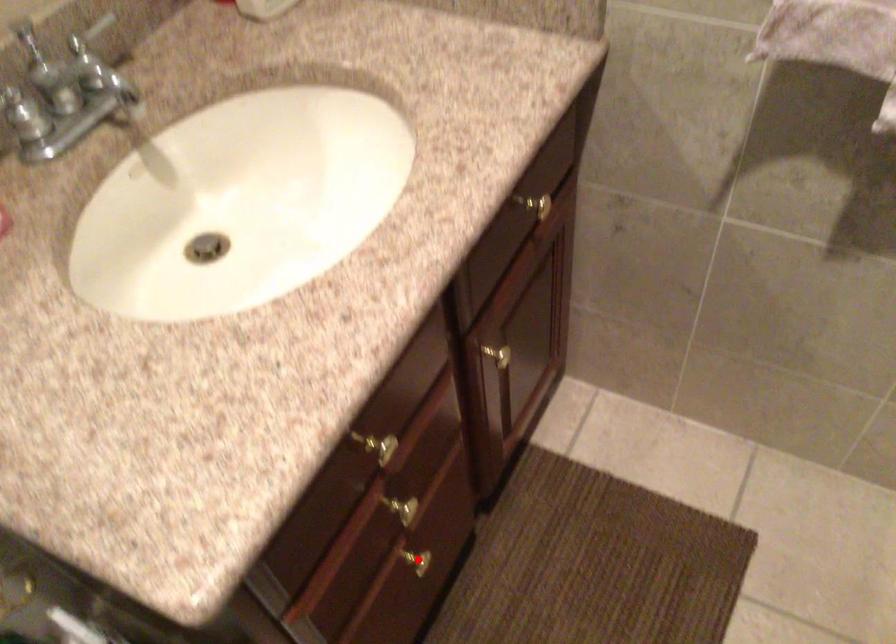
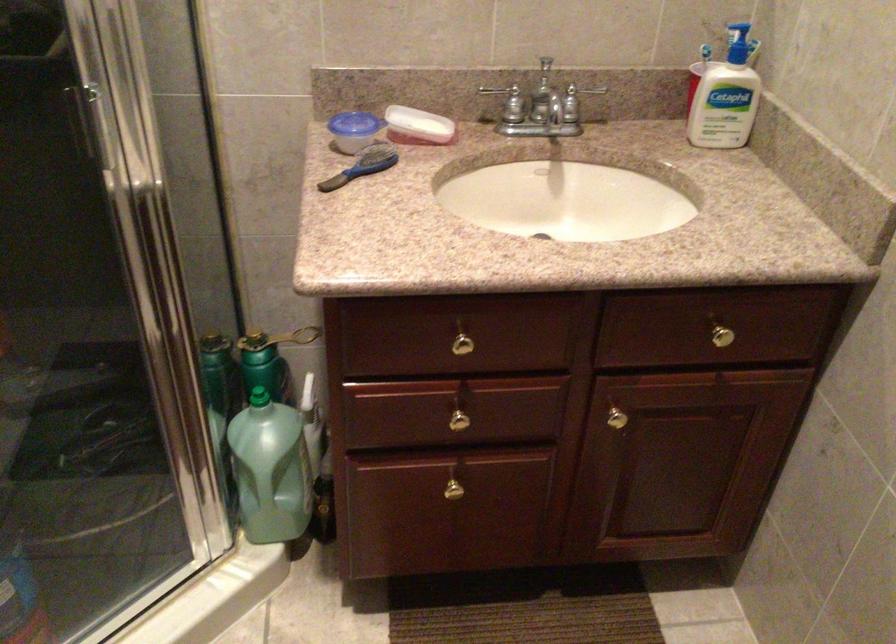
Question: I am providing you with two images of the same scene from different viewpoints. A red point is shown in image1. For the corresponding object point in image2, is it positioned nearer or farther from the camera?

Choices:
 (A) Nearer
 (B) Farther

Answer: (B)